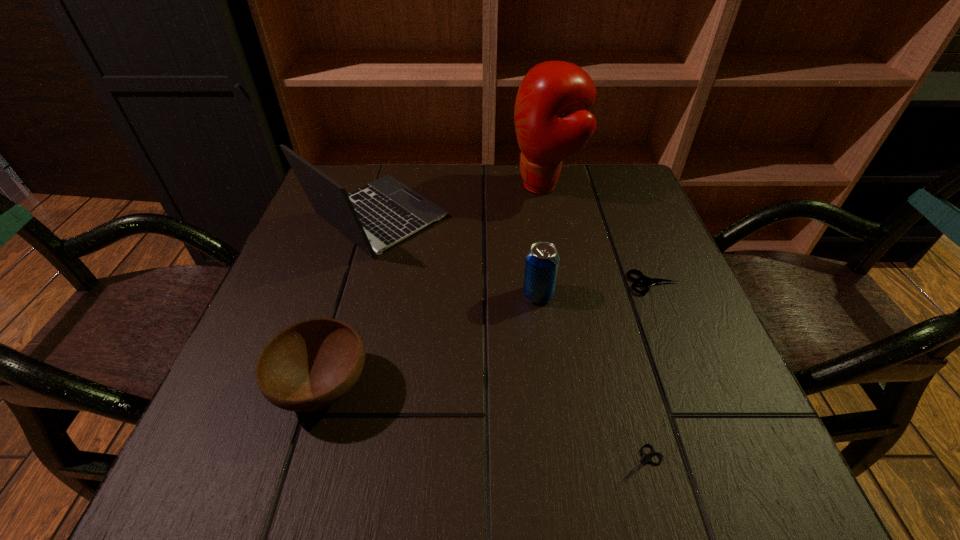
Where is `vacant space located on the striking surface of the tallest object`? The image size is (960, 540). vacant space located on the striking surface of the tallest object is located at coordinates (425, 186).

Find the location of a particular element. vacant position located on the striking surface of the tallest object is located at coordinates (355, 186).

Locate an element on the screen. vacant region located 0.360m at the front screen of the laptop_computer is located at coordinates (602, 217).

At what (x,y) coordinates should I click in order to perform the action: click on free spot located 0.090m on the back of the third tallest object. Please return your answer as a coordinate pair (x, y). Looking at the image, I should click on (533, 254).

Locate an element on the screen. This screenshot has height=540, width=960. vacant area situated 0.320m on the back of the third shortest object is located at coordinates (368, 233).

What are the coordinates of `free space located 0.050m on the left of the taller shears` in the screenshot? It's located at (604, 283).

Identify the location of free space located on the left of the nearer shears. click(574, 465).

Where is `boxing glove at the far edge`? This screenshot has height=540, width=960. boxing glove at the far edge is located at coordinates (552, 120).

Where is `laptop_computer positioned at the far edge`? laptop_computer positioned at the far edge is located at coordinates (385, 211).

Where is `bowl that is at the near edge`? This screenshot has width=960, height=540. bowl that is at the near edge is located at coordinates (311, 364).